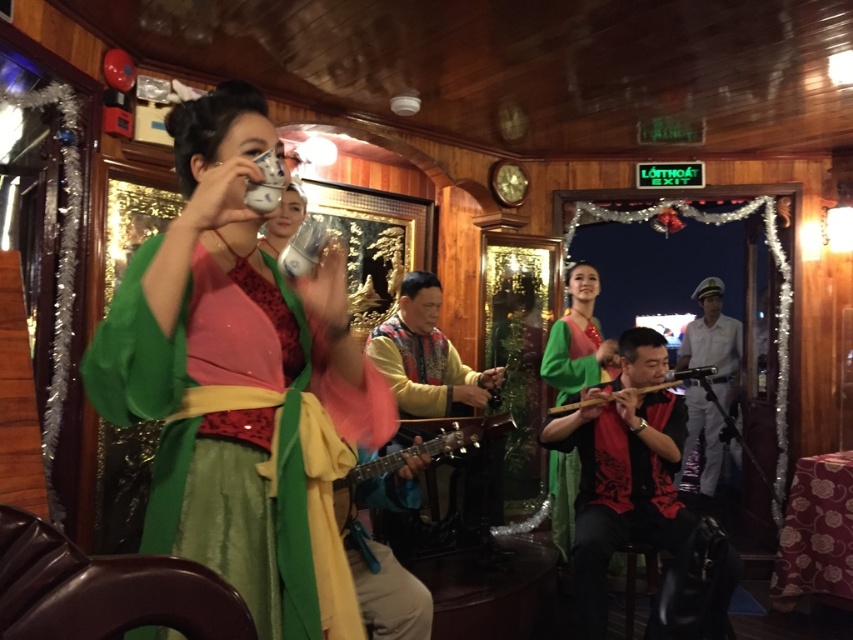
Based on the photo, you are a photographer at the event and want to capture both the green silk dress at center and the multicolored fabric guitar at center in a single frame. Which object should you focus on first to ensure both are in the frame?

The green silk dress at center has a lesser width compared to the multicolored fabric guitar at center, so you should focus on the multicolored fabric guitar at center first to accommodate its larger size within the frame.

You are a photographer at the event and want to capture both the green satin dress at center and the white uniform at center in the same frame. Which one should you position closer to the left side of the camera to ensure they are both visible?

To ensure both the green satin dress at center and the white uniform at center are visible in the frame, position the green satin dress at center closer to the left side of the camera since it is already to the left of the white uniform at center.